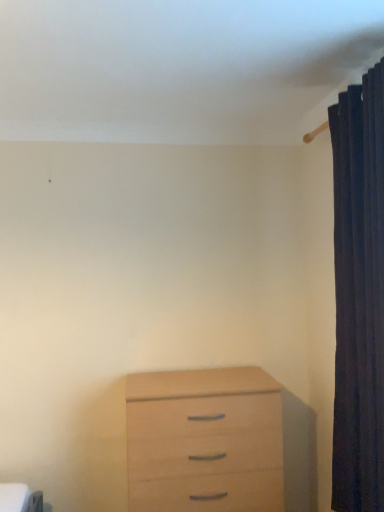
Question: From the image's perspective, is dark fabric curtain at right above or below light wood chest of drawers at lower center?

Choices:
 (A) below
 (B) above

Answer: (B)

Question: Visually, is dark fabric curtain at right positioned to the left or to the right of light wood chest of drawers at lower center?

Choices:
 (A) right
 (B) left

Answer: (A)

Question: Is dark fabric curtain at right wider or thinner than light wood chest of drawers at lower center?

Choices:
 (A) wide
 (B) thin

Answer: (B)

Question: From their relative heights in the image, would you say light wood chest of drawers at lower center is taller or shorter than dark fabric curtain at right?

Choices:
 (A) tall
 (B) short

Answer: (B)

Question: From the image's perspective, relative to dark fabric curtain at right, is light wood chest of drawers at lower center above or below?

Choices:
 (A) below
 (B) above

Answer: (A)

Question: Is light wood chest of drawers at lower center spatially inside dark fabric curtain at right, or outside of it?

Choices:
 (A) inside
 (B) outside

Answer: (B)

Question: Is light wood chest of drawers at lower center wider or thinner than dark fabric curtain at right?

Choices:
 (A) wide
 (B) thin

Answer: (A)